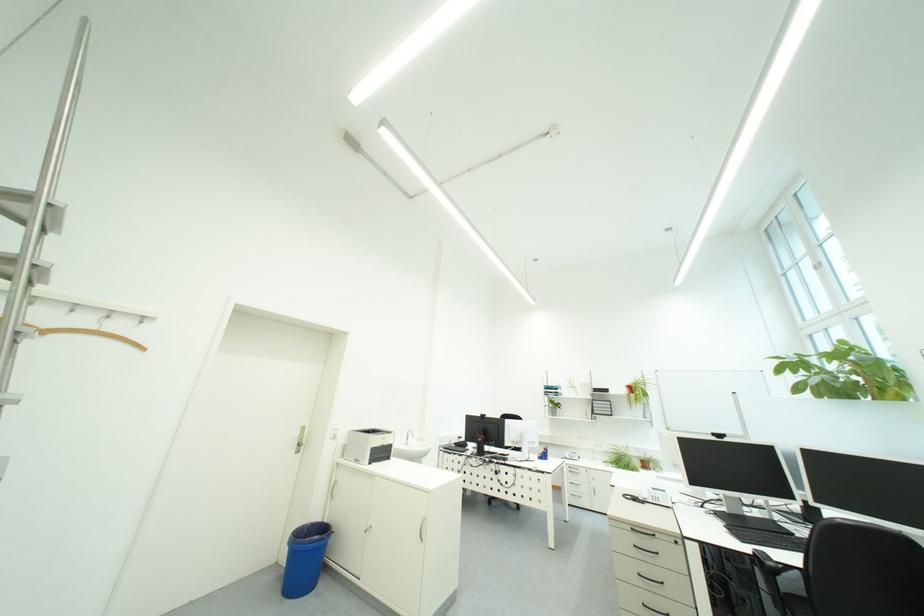
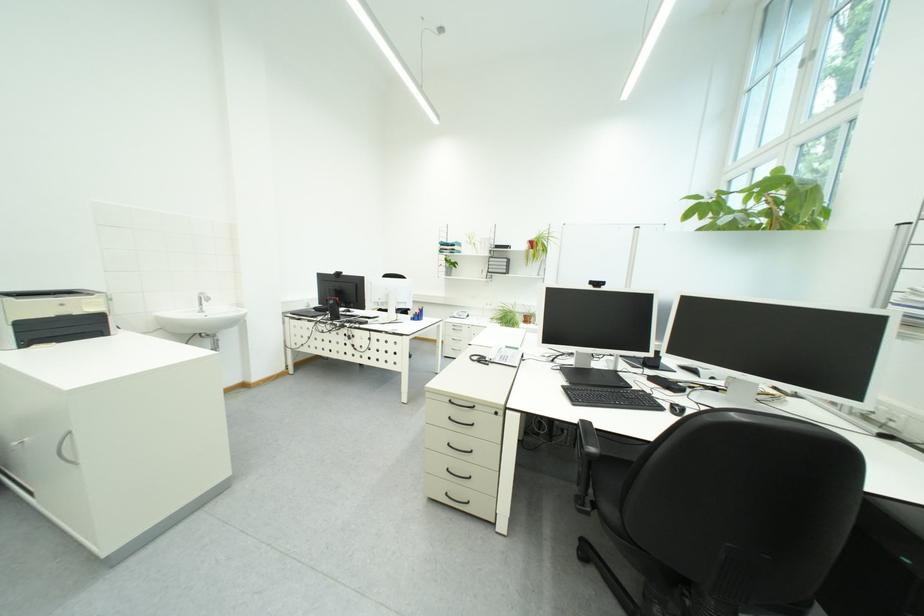
Where in the second image is the point corresponding to (x=388, y=443) from the first image?

(55, 310)